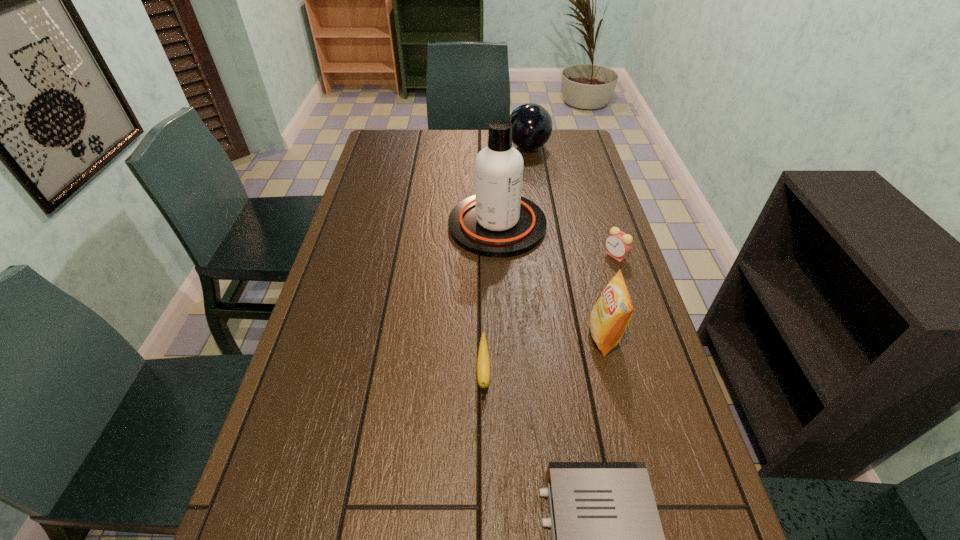
Locate an element on the screen. Image resolution: width=960 pixels, height=540 pixels. object at the far right corner is located at coordinates [x=532, y=125].

The image size is (960, 540). Identify the location of free point at the far edge. (420, 147).

Locate an element on the screen. Image resolution: width=960 pixels, height=540 pixels. free location at the left edge of the desktop is located at coordinates (287, 466).

This screenshot has width=960, height=540. In order to click on free region at the right edge of the desktop in this screenshot , I will do `click(588, 193)`.

Identify the location of free point between the banana and the tallest object. This screenshot has width=960, height=540. (491, 299).

At what (x,y) coordinates should I click in order to perform the action: click on vacant space that is in between the banana and the alarm clock. Please return your answer as a coordinate pair (x, y). Image resolution: width=960 pixels, height=540 pixels. Looking at the image, I should click on (549, 314).

Where is `vacant point located between the banana and the bowling ball`? The width and height of the screenshot is (960, 540). vacant point located between the banana and the bowling ball is located at coordinates (506, 260).

Identify the location of free spot between the crisp (potato chip) and the bowling ball. (566, 242).

The width and height of the screenshot is (960, 540). Find the location of `the closest object relative to the crisp (potato chip)`. the closest object relative to the crisp (potato chip) is located at coordinates (618, 244).

Identify which object is located as the fourth nearest to the farthest object. Please provide its 2D coordinates. Your answer should be formatted as a tuple, i.e. [(x, y)], where the tuple contains the x and y coordinates of a point satisfying the conditions above.

[(483, 363)]